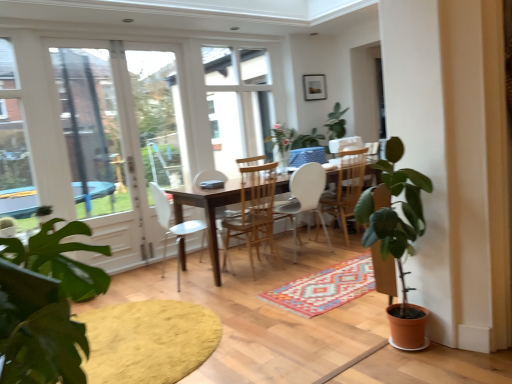
Where is `free space that is in between white plastic chair at center, arranged as the 1th chair when viewed from the left, and wooden table at center`? The width and height of the screenshot is (512, 384). free space that is in between white plastic chair at center, arranged as the 1th chair when viewed from the left, and wooden table at center is located at coordinates (190, 282).